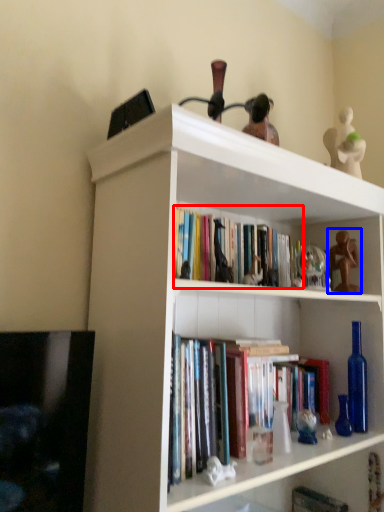
Question: Which of the following is the farthest to the observer, book (highlighted by a red box) or toy (highlighted by a blue box)?

Choices:
 (A) book
 (B) toy

Answer: (B)